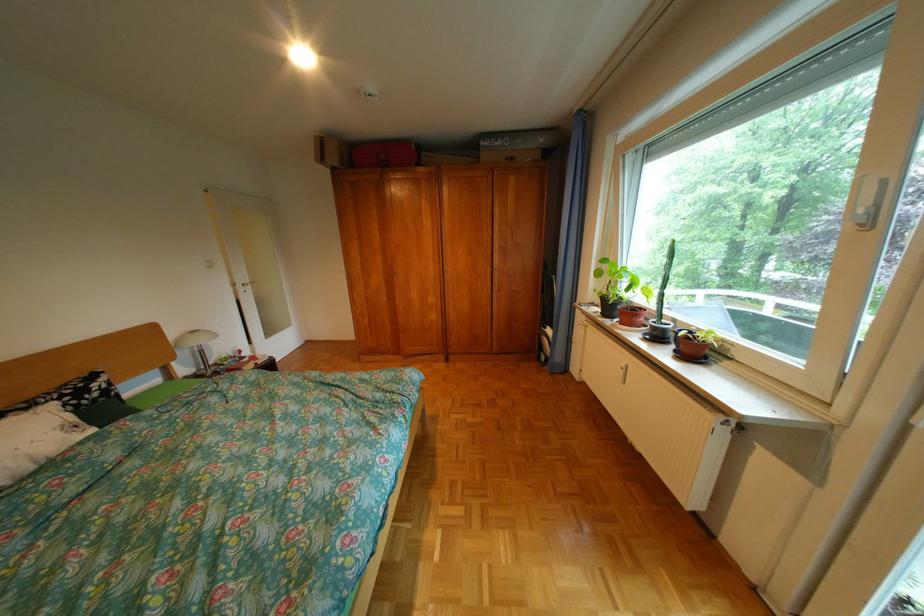
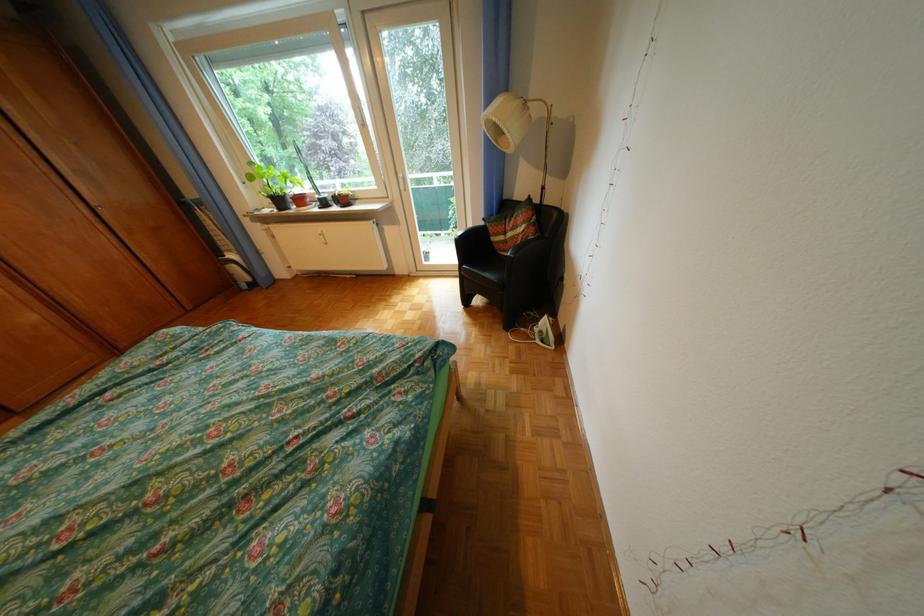
Find the pixel in the second image that matches the point at 614,302 in the first image.

(284, 201)